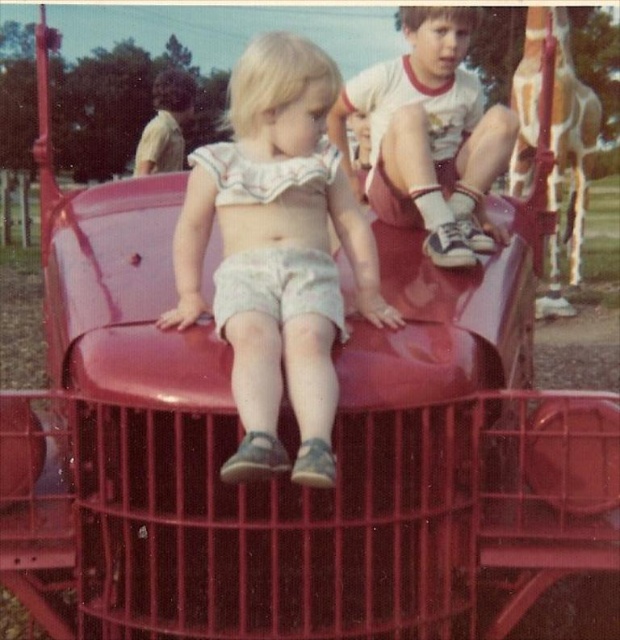
Where is `matte white shorts at center`? The image size is (620, 640). matte white shorts at center is located at coordinates (277, 253).

What do you see at coordinates (277, 253) in the screenshot? The width and height of the screenshot is (620, 640). I see `matte white shorts at center` at bounding box center [277, 253].

Image resolution: width=620 pixels, height=640 pixels. I want to click on matte white shorts at center, so click(277, 253).